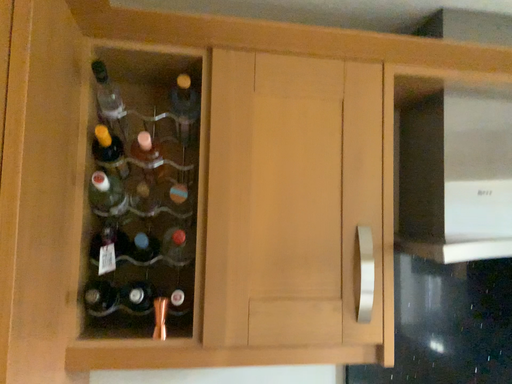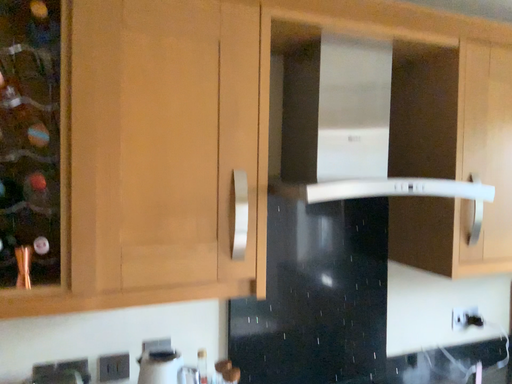
Question: How did the camera likely rotate when shooting the video?

Choices:
 (A) rotated downward
 (B) rotated upward

Answer: (A)